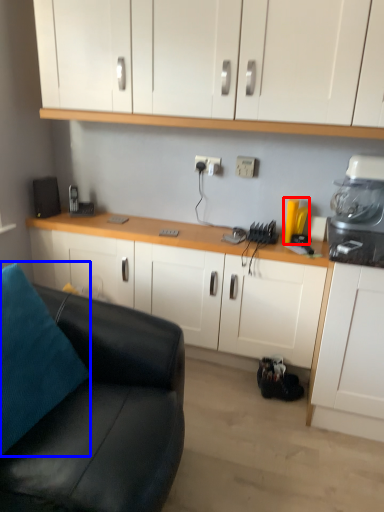
Question: Among these objects, which one is farthest to the camera, appliance (highlighted by a red box) or pillow (highlighted by a blue box)?

Choices:
 (A) appliance
 (B) pillow

Answer: (A)